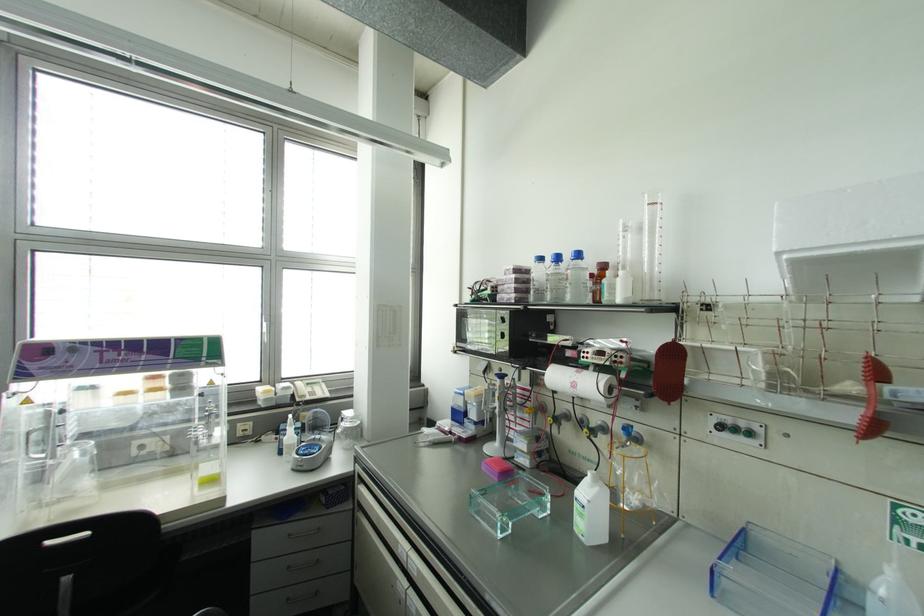
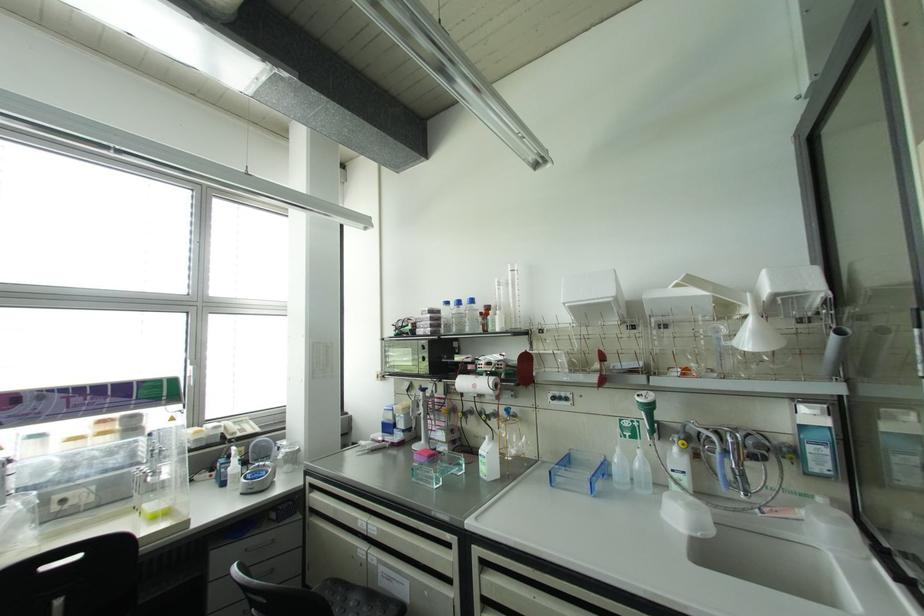
In the second image, find the point that corresponds to point 574,384 in the first image.

(473, 386)